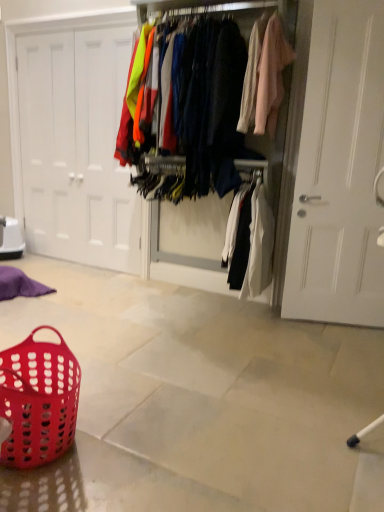
Question: Looking at their shapes, would you say translucent red plastic basket at lower left is wider or thinner than matte fabric clothes at center?

Choices:
 (A) thin
 (B) wide

Answer: (A)

Question: Is translucent red plastic basket at lower left spatially inside matte fabric clothes at center, or outside of it?

Choices:
 (A) outside
 (B) inside

Answer: (A)

Question: Estimate the real-world distances between objects in this image. Which object is farther from the translucent red plastic basket at lower left?

Choices:
 (A) white matte door at left
 (B) matte plastic basket at lower left
 (C) matte fabric clothes at center

Answer: (A)

Question: Based on their relative distances, which object is nearer to the matte plastic basket at lower left?

Choices:
 (A) matte fabric clothes at center
 (B) white matte door at left
 (C) translucent red plastic basket at lower left

Answer: (C)